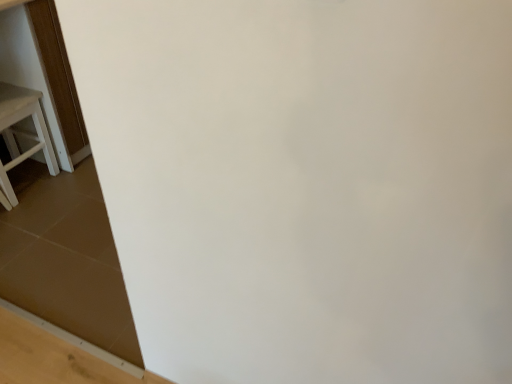
Describe the element at coordinates (21, 135) in the screenshot. The height and width of the screenshot is (384, 512). I see `white wood table at left` at that location.

Find the location of a particular element. white wood table at left is located at coordinates (21, 135).

You are a GUI agent. You are given a task and a screenshot of the screen. Output one action in this format:
    pyautogui.click(x=<x>, y=<y>)
    Task: Click on the white wood table at left
    Image resolution: width=512 pixels, height=384 pixels.
    Given the screenshot: What is the action you would take?
    pyautogui.click(x=21, y=135)